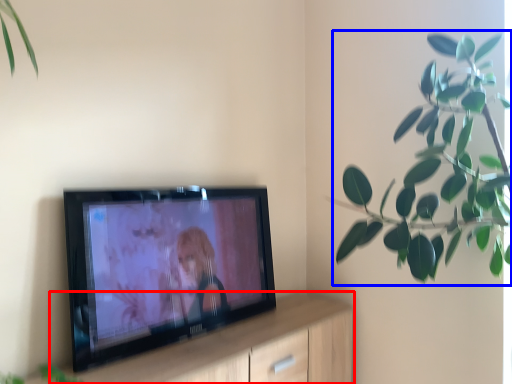
Question: Which object appears farthest to the camera in this image, dresser (highlighted by a red box) or houseplant (highlighted by a blue box)?

Choices:
 (A) dresser
 (B) houseplant

Answer: (B)